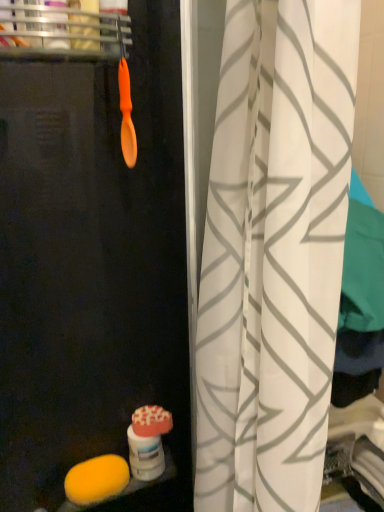
Question: In the image, is orange matte spoon at upper left on the left side or the right side of transparent plastic screen door at center?

Choices:
 (A) left
 (B) right

Answer: (A)

Question: Does point 132,138 appear closer or farther from the camera than point 8,201?

Choices:
 (A) closer
 (B) farther

Answer: (A)

Question: Which is nearer to the transparent plastic screen door at center?

Choices:
 (A) orange matte spoon at upper left
 (B) white fabric curtain at center
 (C) orange plastic spoon at upper left
 (D) yellow sponge at lower left

Answer: (A)

Question: Which of these objects is positioned closest to the orange plastic spoon at upper left?

Choices:
 (A) transparent plastic screen door at center
 (B) yellow sponge at lower left
 (C) orange matte spoon at upper left
 (D) white fabric curtain at center

Answer: (C)